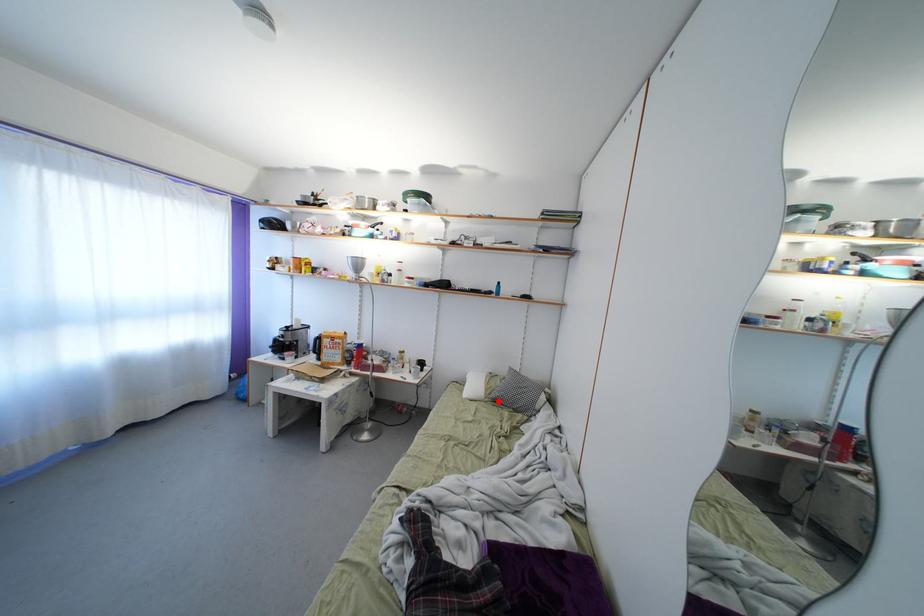
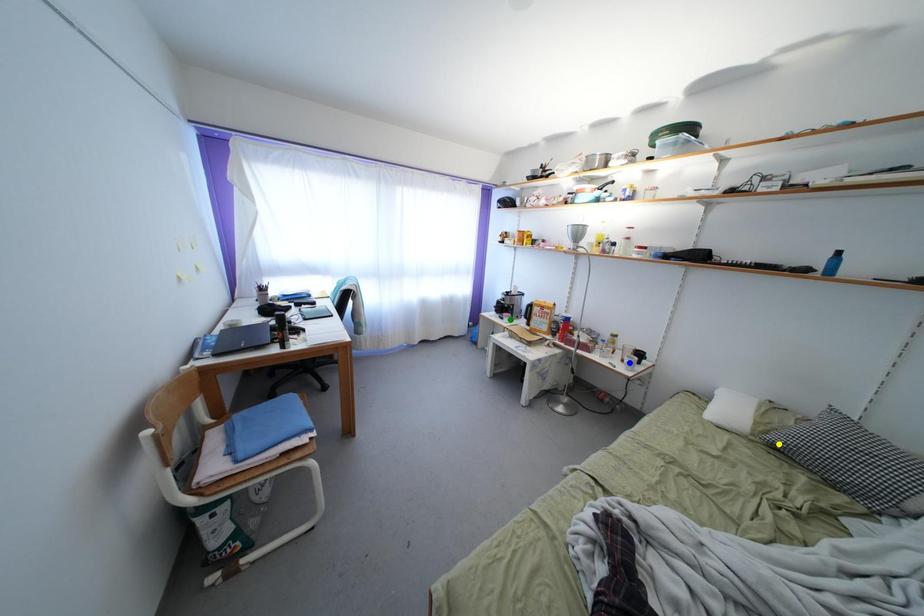
Question: I am providing you with two images of the same scene from different viewpoints. A red point is marked on the first image. You are given multiple points on the second image. Which point in image 2 is actually the same real-world point as the red point in image 1?

Choices:
 (A) yellow point
 (B) green point
 (C) blue point

Answer: (A)